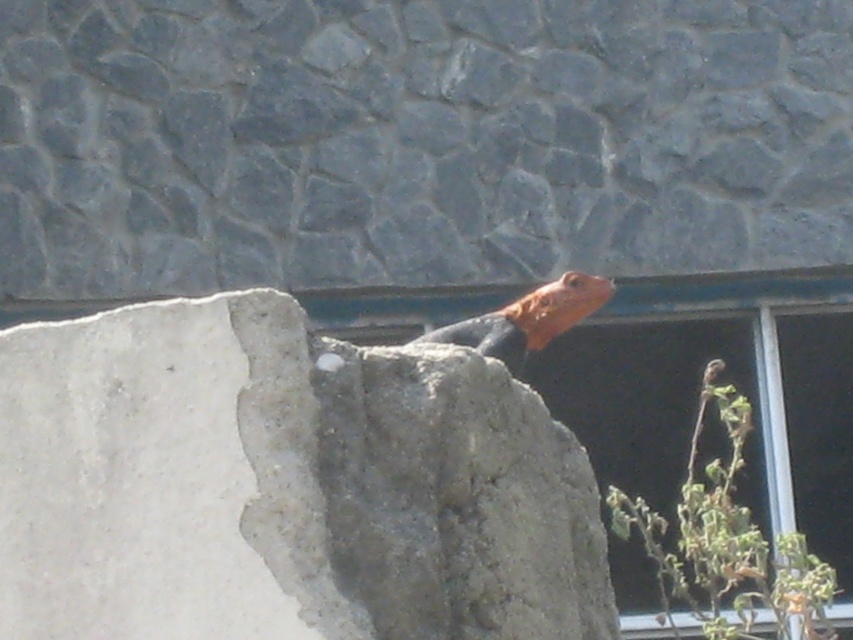
Is gray concrete rock at center smaller than orange-brown scaly lizard at upper center?

No, gray concrete rock at center is not smaller than orange-brown scaly lizard at upper center.

Does gray concrete rock at center appear on the left side of orange-brown scaly lizard at upper center?

Yes, gray concrete rock at center is to the left of orange-brown scaly lizard at upper center.

Locate an element on the screen. The image size is (853, 640). gray concrete rock at center is located at coordinates (283, 484).